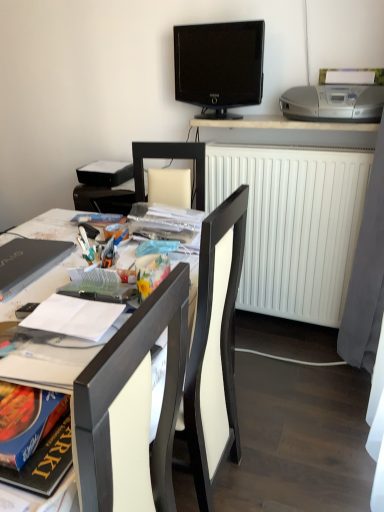
Locate an element on the screen. This screenshot has height=512, width=384. free location above white matte radiator at right (from a real-world perspective) is located at coordinates (286, 141).